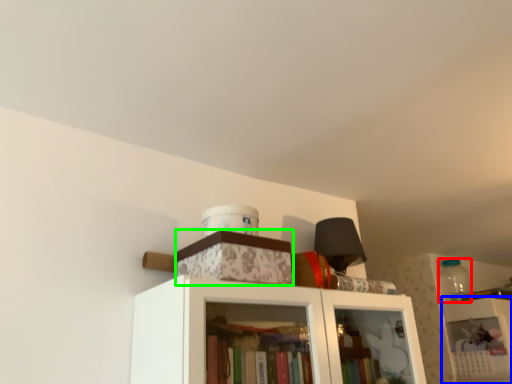
Question: Which object is positioned closest to bottle (highlighted by a red box)? Select from shelf (highlighted by a blue box) and cabinetry (highlighted by a green box).

Choices:
 (A) shelf
 (B) cabinetry

Answer: (A)